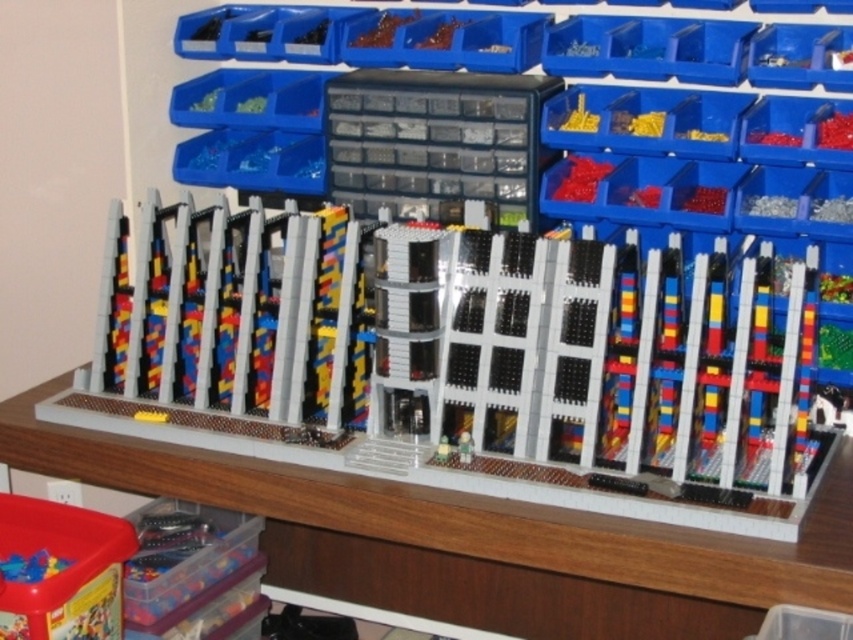
Question: Which point is farther to the camera?

Choices:
 (A) wooden table at center
 (B) brick-patterned lego building at center

Answer: (B)

Question: Can you confirm if brick-patterned lego building at center is positioned above wooden table at center?

Choices:
 (A) yes
 (B) no

Answer: (A)

Question: Does brick-patterned lego building at center have a smaller size compared to wooden table at center?

Choices:
 (A) yes
 (B) no

Answer: (B)

Question: Is brick-patterned lego building at center thinner than wooden table at center?

Choices:
 (A) yes
 (B) no

Answer: (A)

Question: Among these points, which one is nearest to the camera?

Choices:
 (A) (416, 554)
 (B) (94, 420)

Answer: (B)